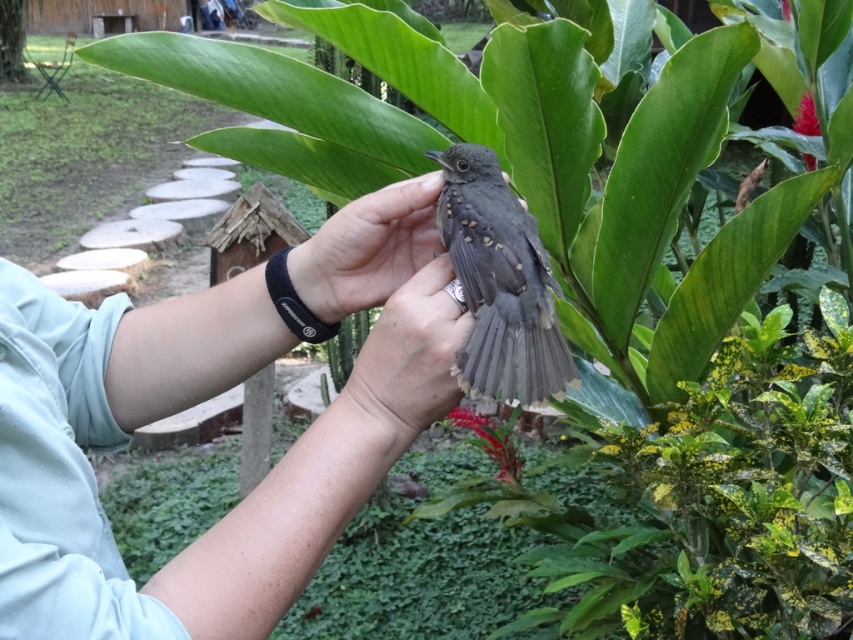
Does matte gray bird at center have a greater height compared to matte gray hand at center?

In fact, matte gray bird at center may be shorter than matte gray hand at center.

Does point (434, 193) come behind point (370, 365)?

That is True.

The height and width of the screenshot is (640, 853). I want to click on matte gray bird at center, so click(x=368, y=248).

Who is more distant from viewer, (x=397, y=269) or (x=410, y=387)?

The point (x=397, y=269) is behind.

From the picture: Is smooth gray bird at center behind matte gray hand at center?

That is False.

Is point (381, 444) positioned before point (451, 358)?

No, it is behind (451, 358).

Locate an element on the screen. The image size is (853, 640). smooth gray bird at center is located at coordinates (212, 396).

Does smooth gray bird at center have a lesser height compared to matte gray bird at center?

No.

Is smooth gray bird at center to the left of matte gray bird at center from the viewer's perspective?

Indeed, smooth gray bird at center is positioned on the left side of matte gray bird at center.

Between point (62, 547) and point (416, 228), which one is positioned behind?

The point (416, 228) is more distant.

The height and width of the screenshot is (640, 853). In order to click on smooth gray bird at center in this screenshot , I will do coord(212,396).